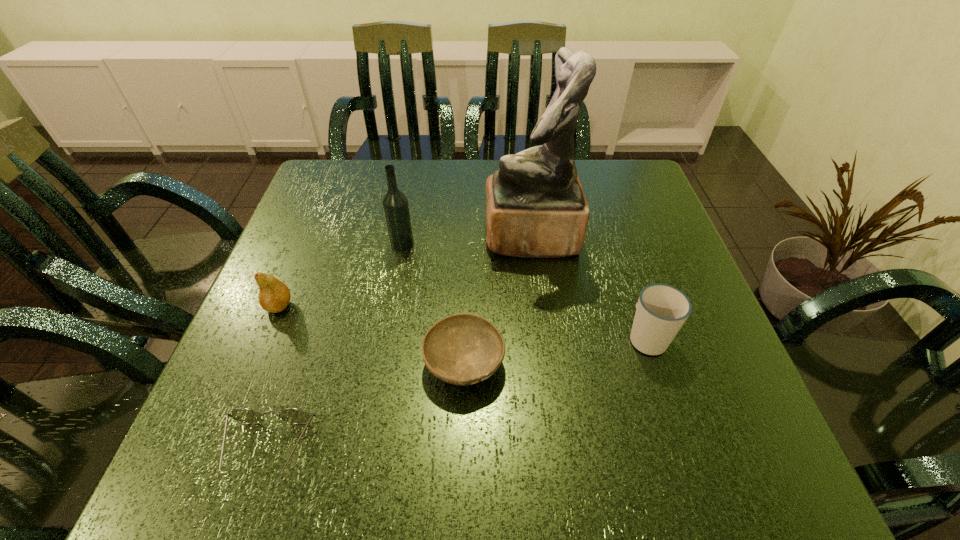
The image size is (960, 540). In order to click on free space between the pear and the bowl in this screenshot , I will do `click(372, 334)`.

Identify the location of vacant area that lies between the sculpture and the second tallest object. (467, 240).

The image size is (960, 540). I want to click on free space that is in between the second tallest object and the bowl, so click(x=433, y=303).

Locate an element on the screen. This screenshot has width=960, height=540. unoccupied position between the sculpture and the nearest object is located at coordinates (399, 343).

The width and height of the screenshot is (960, 540). Identify the location of unoccupied position between the sculpture and the cup. (589, 287).

You are a GUI agent. You are given a task and a screenshot of the screen. Output one action in this format:
    pyautogui.click(x=<x>, y=<y>)
    Task: Click on the free space between the pear and the vodka
    The image size is (960, 540).
    Given the screenshot: What is the action you would take?
    pyautogui.click(x=341, y=275)

Identify the location of empty space between the pear and the spectacles. (274, 378).

At what (x,y) coordinates should I click in order to perform the action: click on object that is the second closest to the bowl. Please return your answer as a coordinate pair (x, y). The width and height of the screenshot is (960, 540). Looking at the image, I should click on (535, 205).

The image size is (960, 540). In order to click on object that is the closest to the spectacles in this screenshot , I will do `click(462, 349)`.

Identify the location of vacant space that satisfies the following two spatial constraints: 1. in a relaxed pose on the sculpture; 2. on the front-facing side of the spectacles. (558, 450).